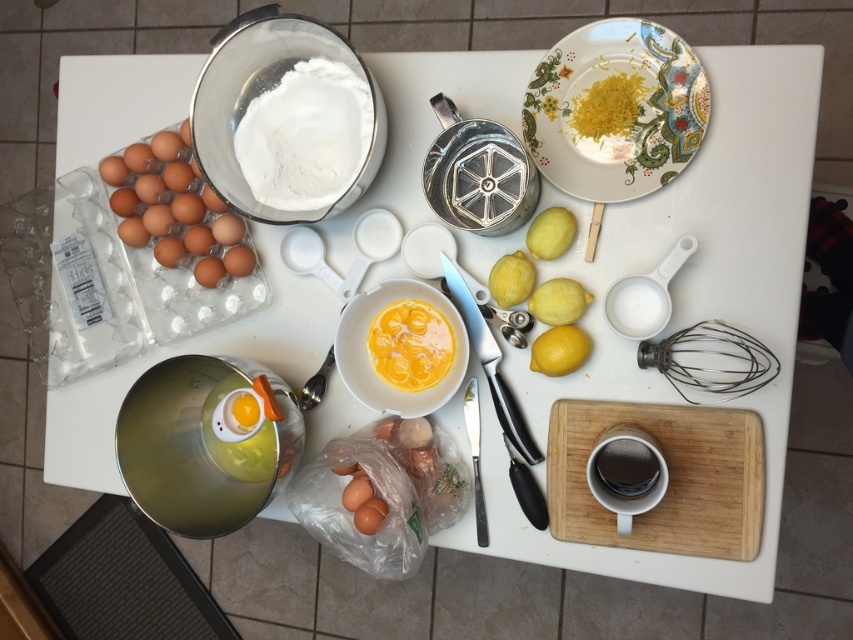
Does yellow powder at upper right have a smaller size compared to yellow matte lemon at center-right?

No.

Does yellow powder at upper right appear under yellow matte lemon at center-right?

No, yellow powder at upper right is not below yellow matte lemon at center-right.

Is point (628, 124) closer to viewer compared to point (561, 346)?

No.

This screenshot has height=640, width=853. I want to click on yellow powder at upper right, so click(608, 106).

Looking at this image, can you confirm if wooden cutting board at bottom right is bigger than yellow powder at upper right?

Indeed, wooden cutting board at bottom right has a larger size compared to yellow powder at upper right.

What do you see at coordinates (669, 476) in the screenshot? I see `wooden cutting board at bottom right` at bounding box center [669, 476].

Which is in front, point (746, 525) or point (619, 99)?

Point (746, 525)

This screenshot has width=853, height=640. Identify the location of wooden cutting board at bottom right. (669, 476).

Does wooden cutting board at bottom right have a larger size compared to yellow smooth egg yolk at center?

Indeed, wooden cutting board at bottom right has a larger size compared to yellow smooth egg yolk at center.

Can you confirm if wooden cutting board at bottom right is wider than yellow smooth egg yolk at center?

Yes.

Who is more distant from viewer, [732,552] or [402,348]?

The point [402,348] is more distant.

Find the location of `wooden cutting board at bottom right`. wooden cutting board at bottom right is located at coordinates (669, 476).